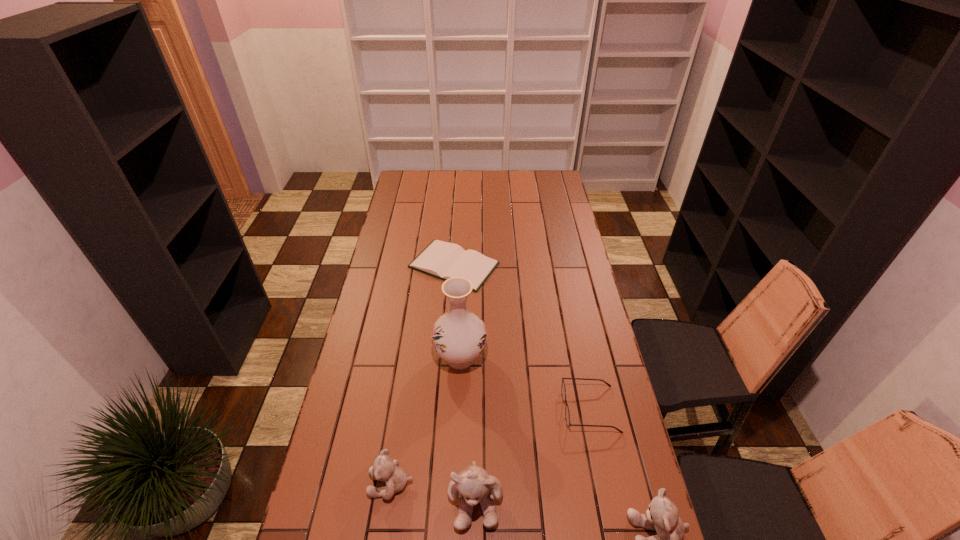
If equal spacing is desired by inserting an extra teddy_bear among them, please point out a free spot for this new teddy_bear. Please provide its 2D coordinates. Your answer should be formatted as a tuple, i.e. [(x, y)], where the tuple contains the x and y coordinates of a point satisfying the conditions above.

[(564, 515)]